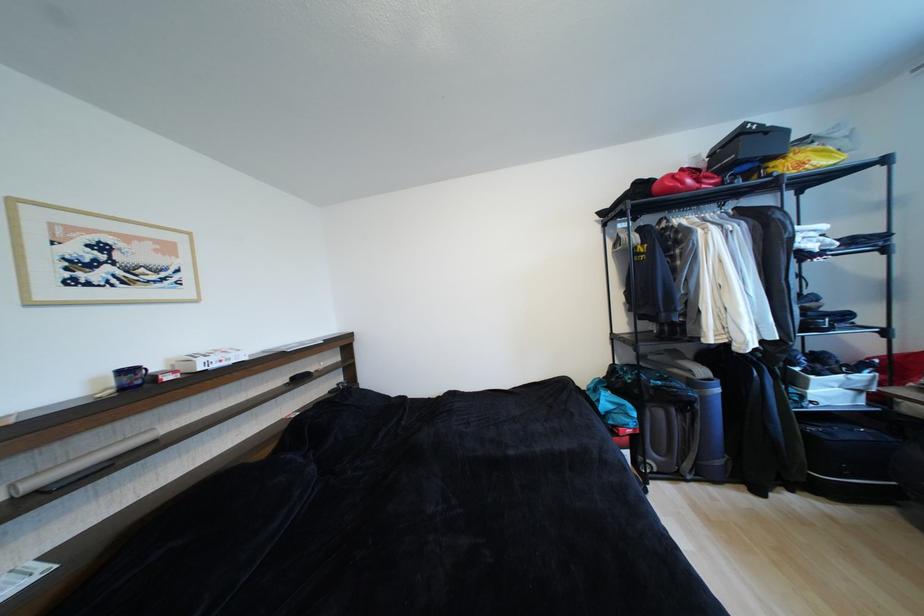
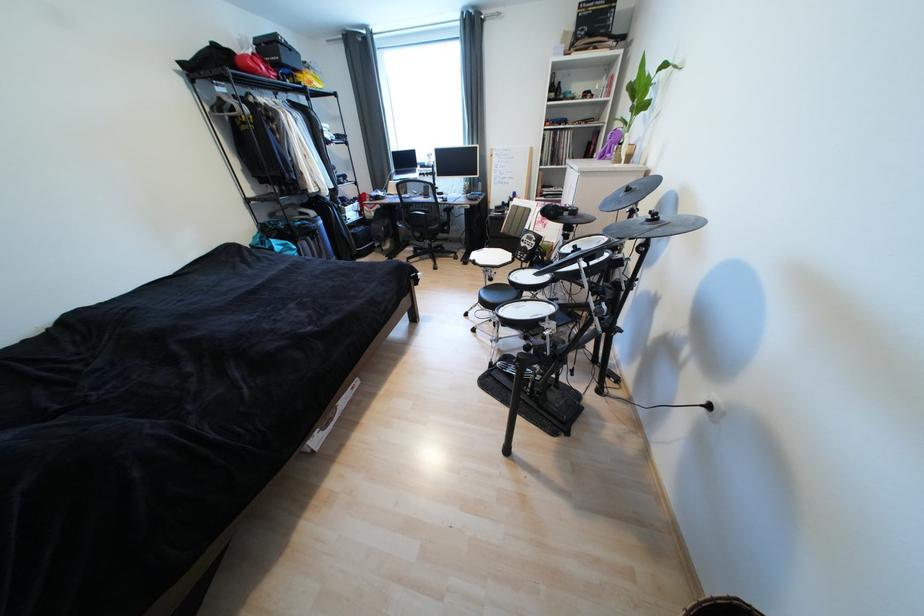
In the second image, find the point that corresponds to [676,192] in the first image.

(261, 73)